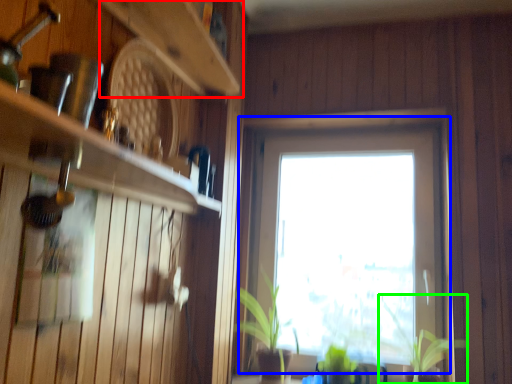
Question: Which is nearer to the shelf (highlighted by a red box)? window (highlighted by a blue box) or plant (highlighted by a green box).

Choices:
 (A) window
 (B) plant

Answer: (A)